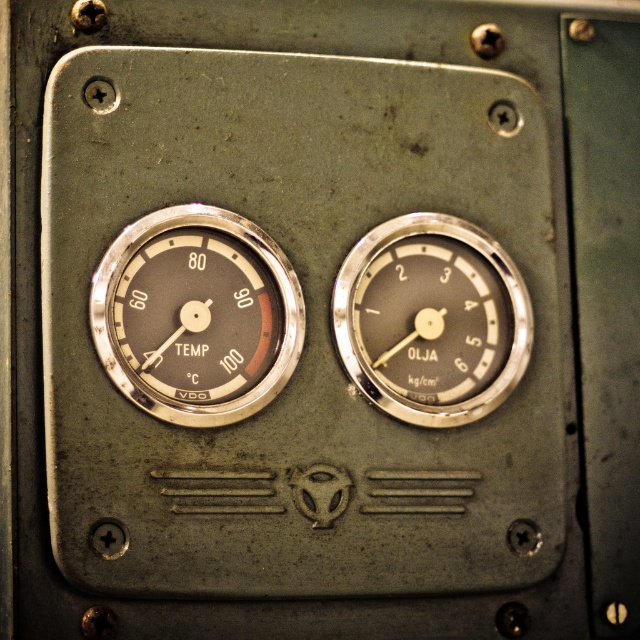
Which is more to the left, matte silver gauge at upper left or metallic silver gauge at center?

From the viewer's perspective, matte silver gauge at upper left appears more on the left side.

Which of these two, matte silver gauge at upper left or metallic silver gauge at center, stands shorter?

Standing shorter between the two is matte silver gauge at upper left.

Between point (196, 220) and point (464, 380), which one is positioned in front?

Point (196, 220)

You are a GUI agent. You are given a task and a screenshot of the screen. Output one action in this format:
    pyautogui.click(x=<x>, y=<y>)
    Task: Click on the matte silver gauge at upper left
    The height and width of the screenshot is (640, 640).
    Given the screenshot: What is the action you would take?
    pyautogui.click(x=196, y=316)